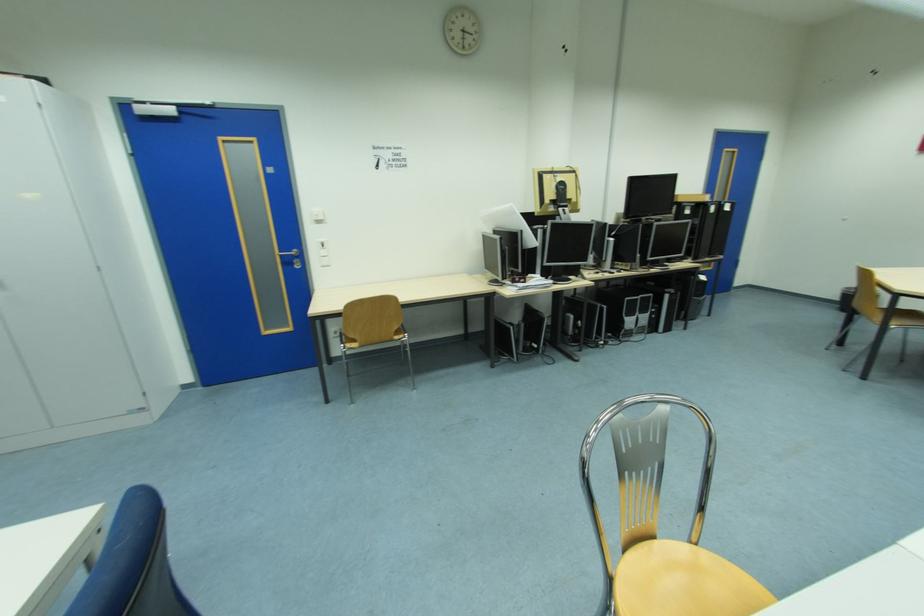
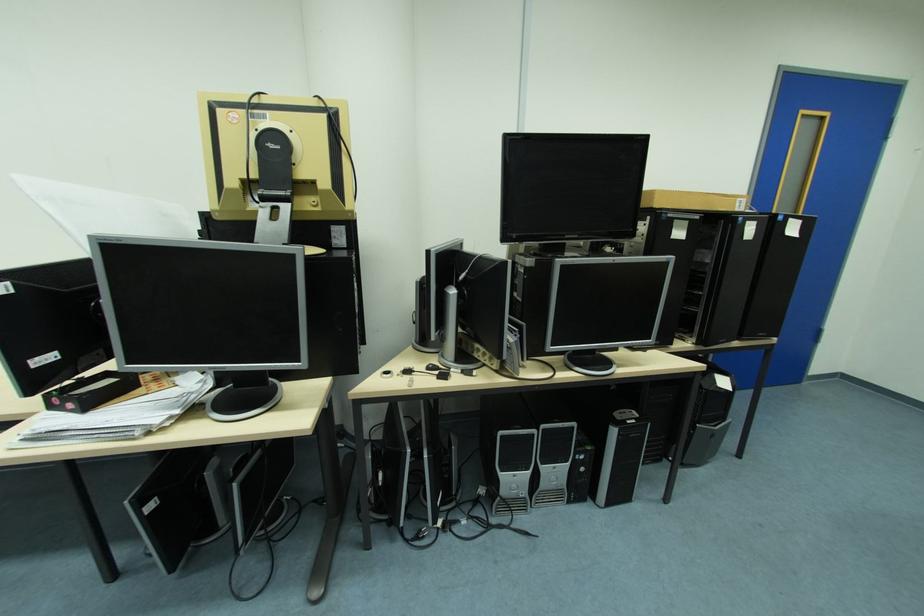
Which direction would the cameraman need to move to produce the second image?

The cameraman walked toward right, forward.